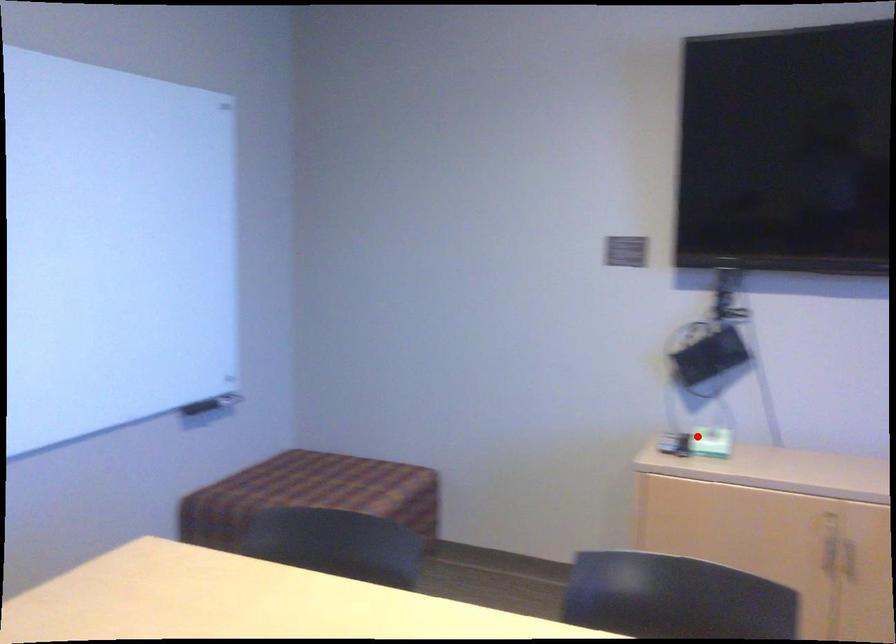
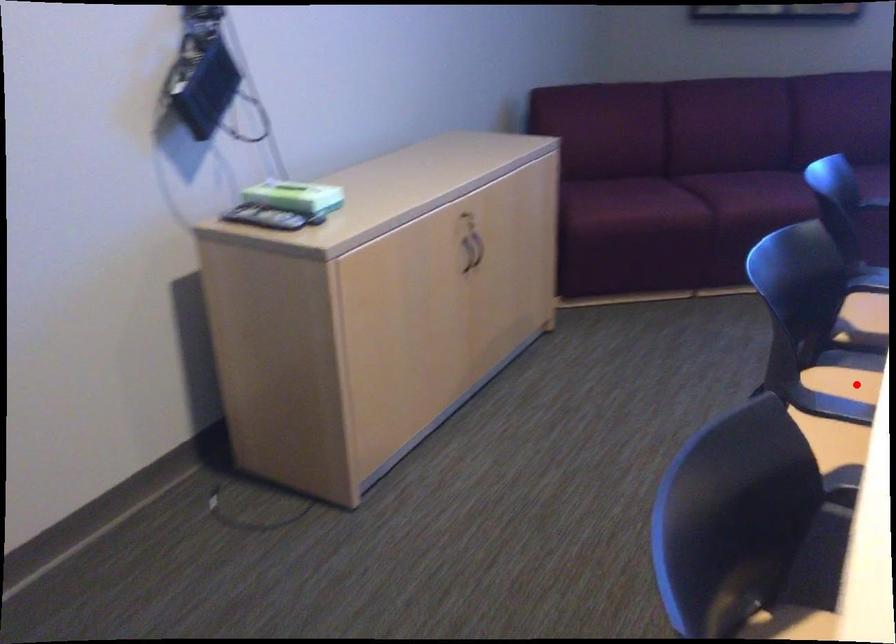
I am providing you with two images of the same scene from different viewpoints. A red point is marked on the first image and another point is marked on the second image. Does the point marked in image1 correspond to the same location as the one in image2?

No